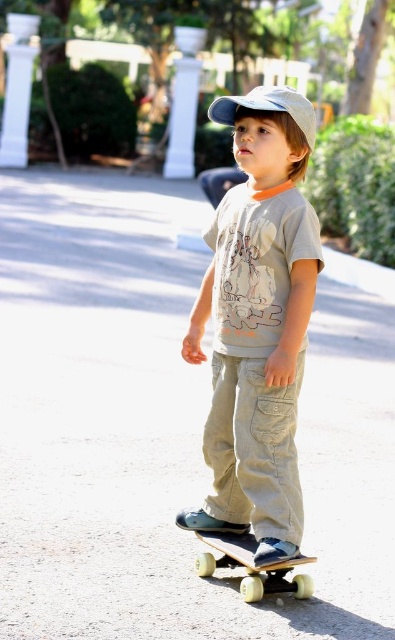
Who is taller, light gray cotton shirt at center or white matte baseball hat at center?

Standing taller between the two is white matte baseball hat at center.

Does light gray cotton shirt at center appear over white matte baseball hat at center?

Incorrect, light gray cotton shirt at center is not positioned above white matte baseball hat at center.

Is point (310, 211) less distant than point (231, 104)?

Yes, it is.

Find the location of `light gray cotton shirt at center`. light gray cotton shirt at center is located at coordinates (257, 323).

Can you confirm if yellow wheels skateboard at center is positioned below white matte baseball hat at center?

Yes, yellow wheels skateboard at center is below white matte baseball hat at center.

Image resolution: width=395 pixels, height=640 pixels. In order to click on yellow wheels skateboard at center in this screenshot , I will do point(253,566).

Is point (252, 572) farther from viewer compared to point (229, 97)?

No, (252, 572) is in front of (229, 97).

Locate an element on the screen. yellow wheels skateboard at center is located at coordinates (253, 566).

Can you confirm if light gray cotton shirt at center is taller than yellow wheels skateboard at center?

Yes.

Does light gray cotton shirt at center have a larger size compared to yellow wheels skateboard at center?

Yes.

From the picture: Who is more distant from viewer, [285,344] or [208,540]?

Positioned behind is point [208,540].

What are the coordinates of `light gray cotton shirt at center` in the screenshot? It's located at (257, 323).